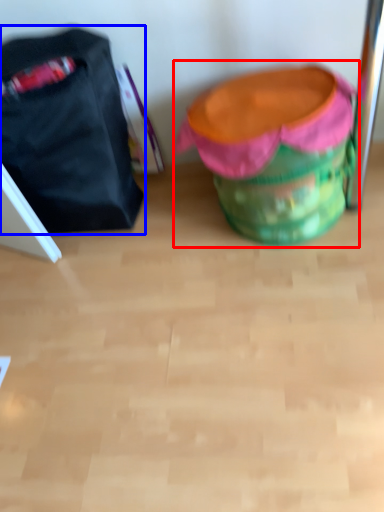
Question: Which object is closer to the camera taking this photo, bean bag chair (highlighted by a red box) or luggage and bags (highlighted by a blue box)?

Choices:
 (A) bean bag chair
 (B) luggage and bags

Answer: (A)